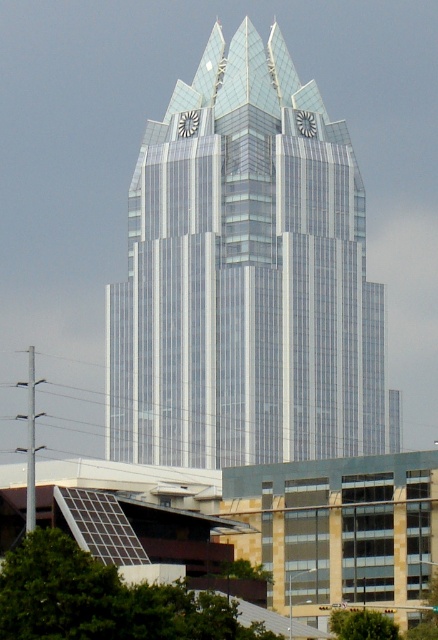
Find the location of `transparent glass skyscraper at center`. transparent glass skyscraper at center is located at coordinates (246, 278).

Does transparent glass skyscraper at center have a larger size compared to green leafy tree at lower left?

Indeed, transparent glass skyscraper at center has a larger size compared to green leafy tree at lower left.

Image resolution: width=438 pixels, height=640 pixels. I want to click on transparent glass skyscraper at center, so click(x=246, y=278).

Between transparent glass skyscraper at center and green leafy tree at lower center, which one appears on the right side from the viewer's perspective?

green leafy tree at lower center

Between transparent glass skyscraper at center and green leafy tree at lower center, which one has less height?

Standing shorter between the two is green leafy tree at lower center.

Is point (239, 220) positioned after point (377, 621)?

Yes.

Find the location of `transparent glass skyscraper at center`. transparent glass skyscraper at center is located at coordinates (246, 278).

Between green leafy tree at lower left and green leafy tree at lower center, which one is positioned higher?

green leafy tree at lower left is above.

Which of these two, green leafy tree at lower left or green leafy tree at lower center, stands shorter?

green leafy tree at lower center

Between point (48, 552) and point (382, 627), which one is positioned in front?

Point (48, 552)

Find the location of a particular element. green leafy tree at lower left is located at coordinates (102, 600).